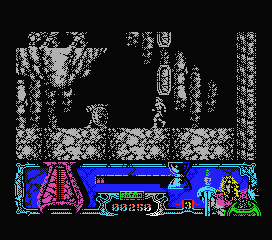
Find the location of a particular element. Image resolution: width=272 pixels, height=240 pixels. vertical grey and black column is located at coordinates (246, 104).